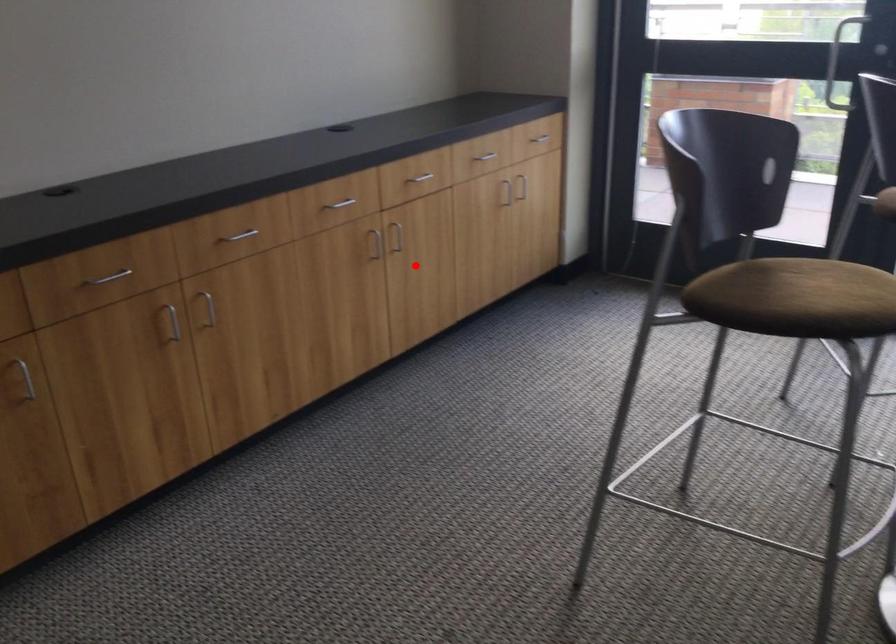
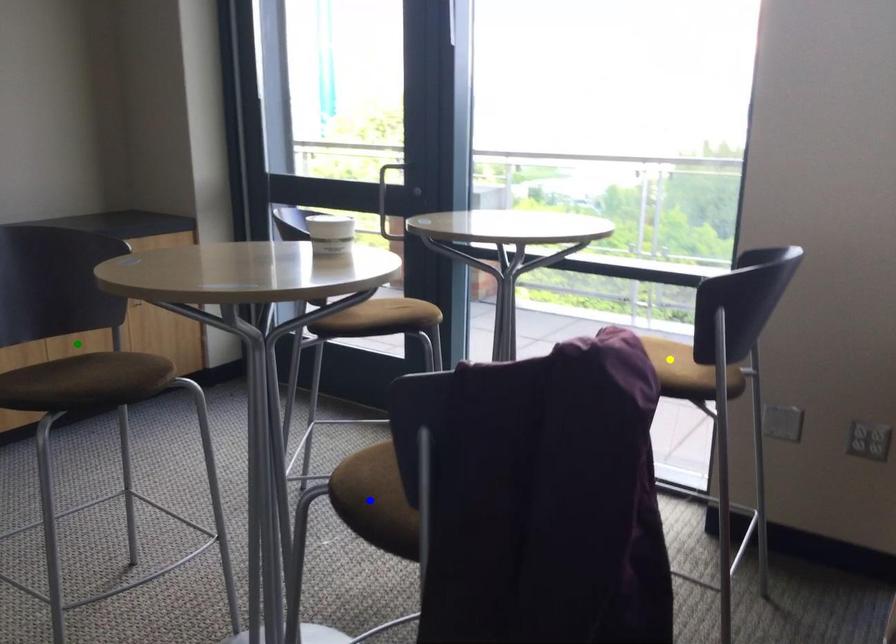
Question: I am providing you with two images of the same scene from different viewpoints. A red point is marked on the first image. You are given multiple points on the second image. Which mark in image 2 goes with the point in image 1?

Choices:
 (A) green point
 (B) yellow point
 (C) blue point

Answer: (A)